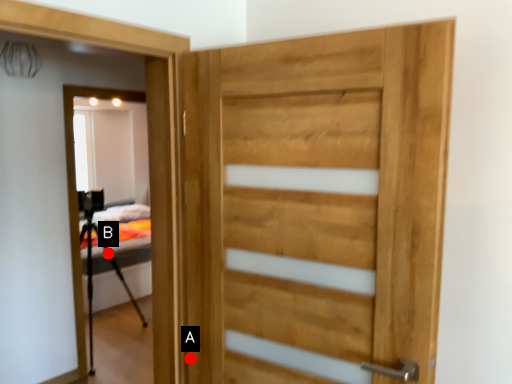
Question: Two points are circled on the image, labeled by A and B beside each circle. Which point appears closest to the camera in this image?

Choices:
 (A) A is closer
 (B) B is closer

Answer: (A)